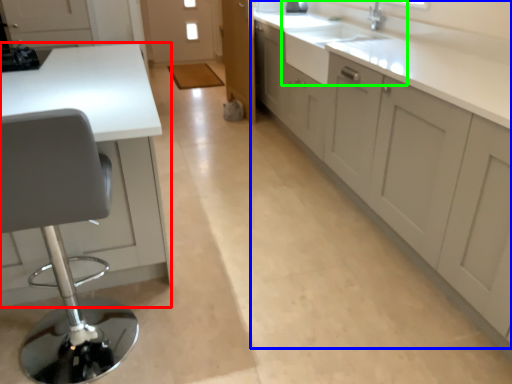
Question: Based on their relative distances, which object is farther from countertop (highlighted by a red box)? Choose from cabinetry (highlighted by a blue box) and sink (highlighted by a green box).

Choices:
 (A) cabinetry
 (B) sink

Answer: (B)